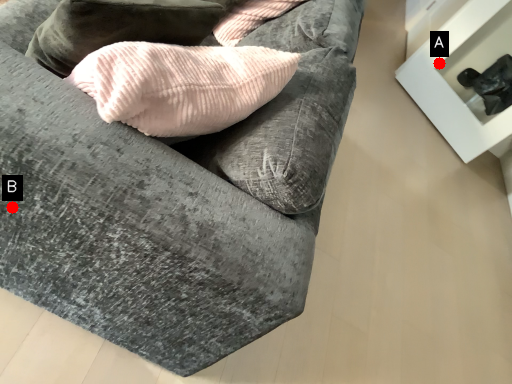
Question: Two points are circled on the image, labeled by A and B beside each circle. Which point appears farthest from the camera in this image?

Choices:
 (A) A is further
 (B) B is further

Answer: (A)